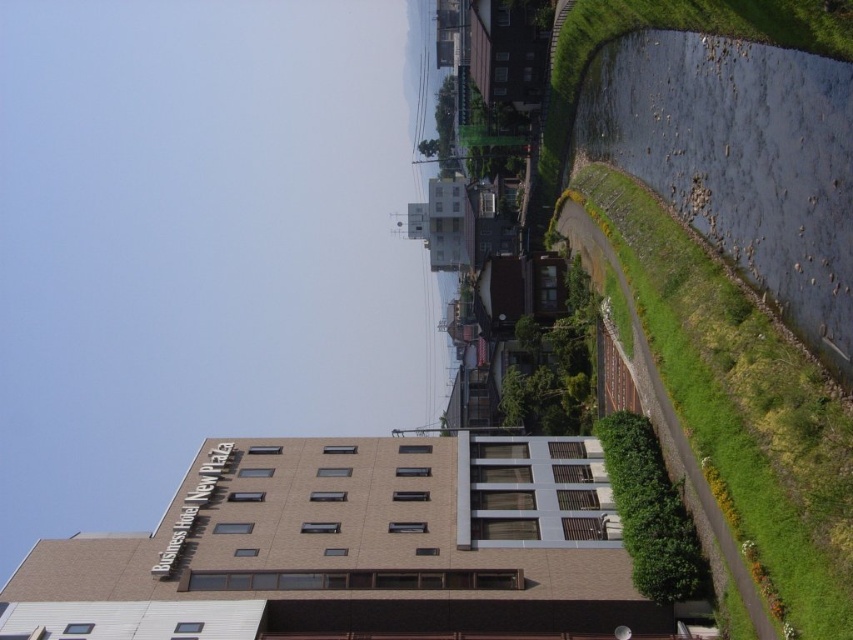
Question: Which of the following is the farthest from the observer?

Choices:
 (A) brown brick building at center
 (B) green grass at right

Answer: (A)

Question: Does brown brick building at center have a larger size compared to green grass at right?

Choices:
 (A) no
 (B) yes

Answer: (B)

Question: Which point is farther to the camera?

Choices:
 (A) green grass at right
 (B) brown brick building at center

Answer: (B)

Question: Is brown brick building at center positioned at the back of green grass at right?

Choices:
 (A) yes
 (B) no

Answer: (A)

Question: Does brown brick building at center appear under green grass at right?

Choices:
 (A) no
 (B) yes

Answer: (B)